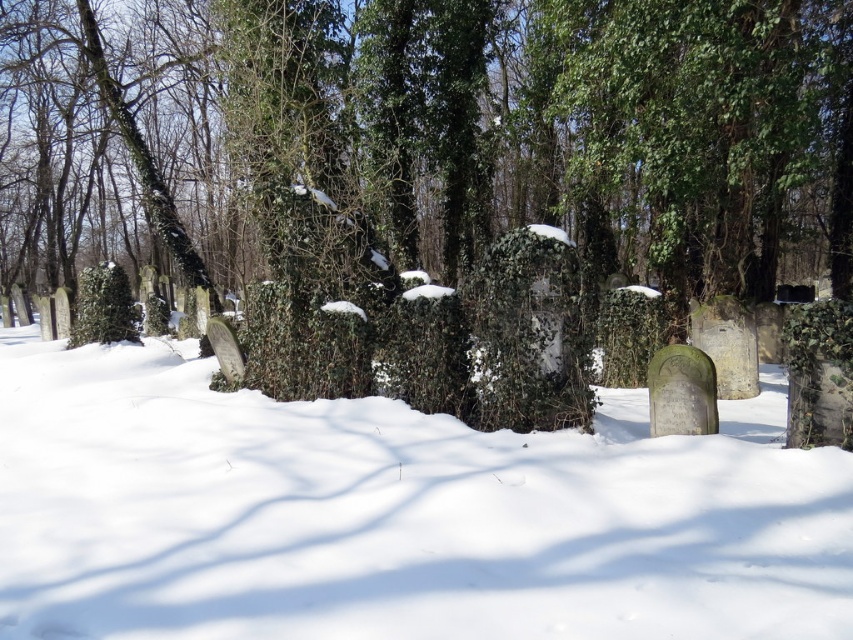
Between point (36, 204) and point (706, 433), which one is positioned in front?

Point (706, 433) is more forward.

Between green ivy-covered tree at center and gray stone gravestone at center, which one is positioned lower?

Positioned lower is gray stone gravestone at center.

Is point (390, 177) positioned behind point (683, 353)?

Yes, it is behind point (683, 353).

Image resolution: width=853 pixels, height=640 pixels. I want to click on green ivy-covered tree at center, so click(x=442, y=128).

Does white powdery snow at center appear under gray stone gravestone at center?

Indeed, white powdery snow at center is positioned under gray stone gravestone at center.

Which is above, white powdery snow at center or gray stone gravestone at center?

gray stone gravestone at center is higher up.

Between point (4, 600) and point (653, 374), which one is positioned in front?

Point (4, 600) is in front.

This screenshot has width=853, height=640. I want to click on white powdery snow at center, so click(395, 513).

Is green ivy-covered tree at center smaller than white powdery snow at center?

Incorrect, green ivy-covered tree at center is not smaller in size than white powdery snow at center.

Does point (467, 184) come closer to viewer compared to point (7, 339)?

Yes, point (467, 184) is in front of point (7, 339).

Image resolution: width=853 pixels, height=640 pixels. In order to click on green ivy-covered tree at center in this screenshot , I will do `click(442, 128)`.